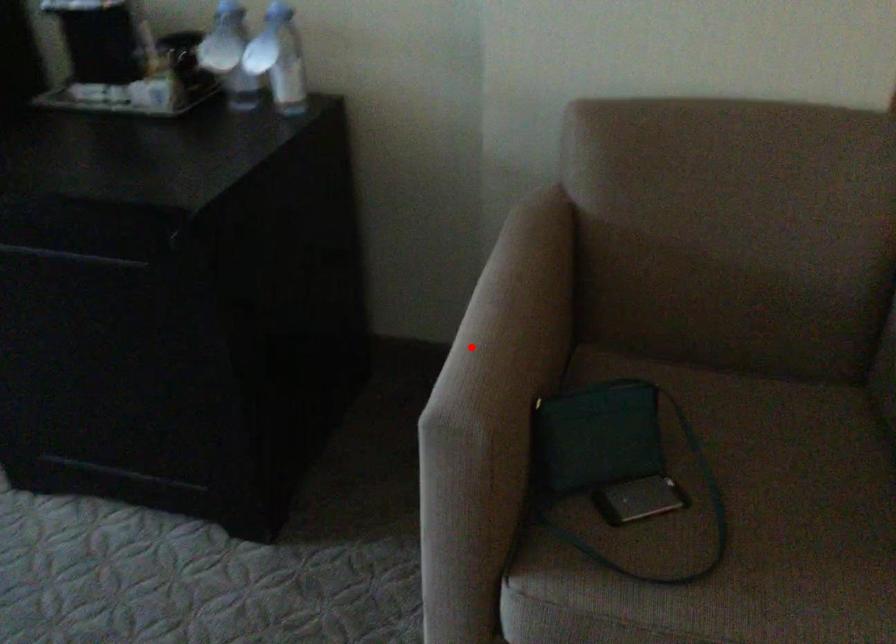
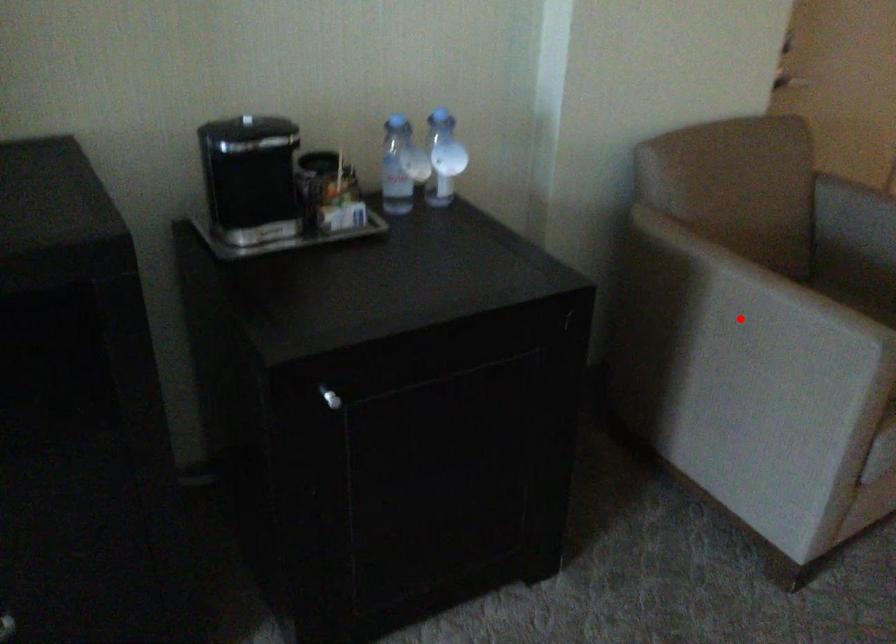
I am providing you with two images of the same scene from different viewpoints. A red point is marked on the first image and another point is marked on the second image. Is the marked point in image1 the same physical position as the marked point in image2?

Yes